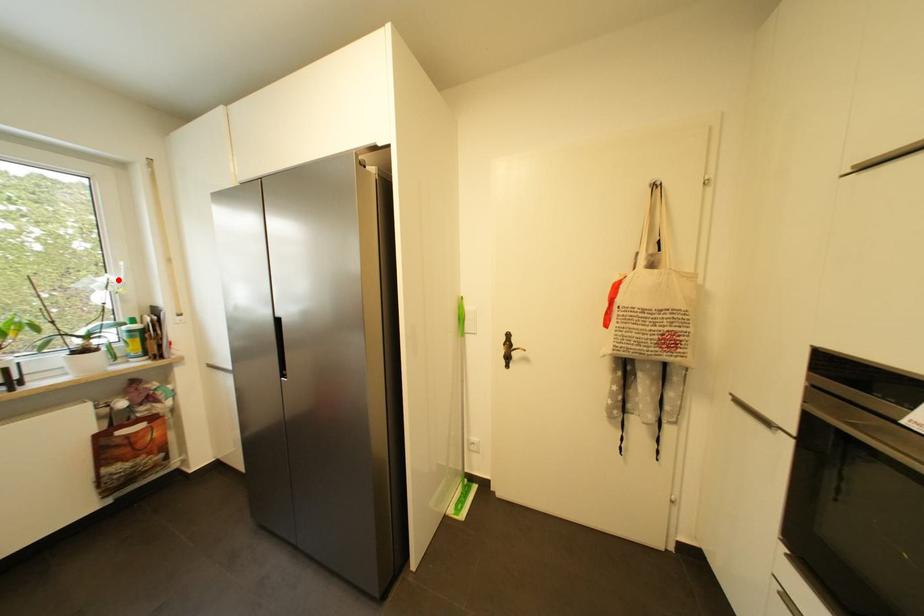
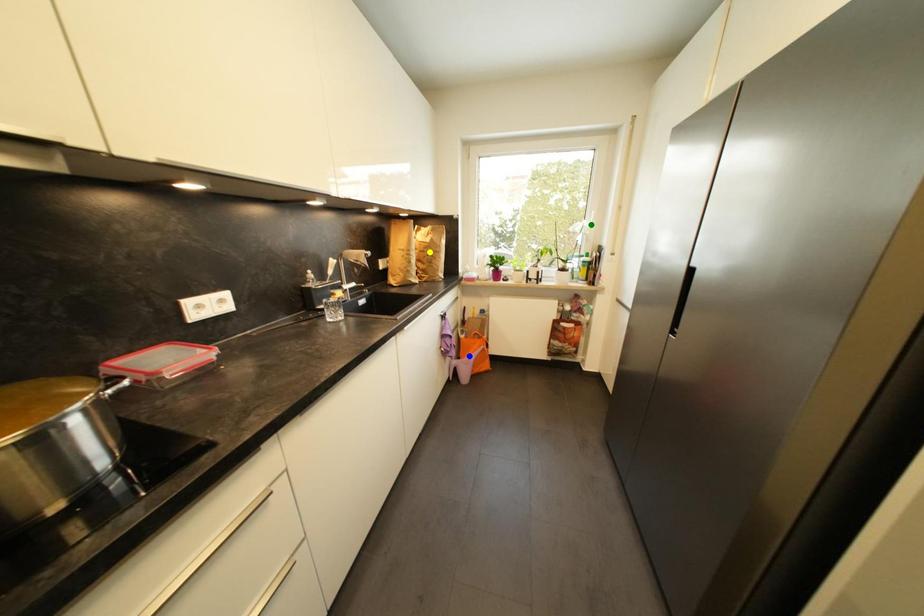
Question: I am providing you with two images of the same scene from different viewpoints. A red point is marked on the first image. You are given multiple points on the second image. Which point in image 2 represents the same 3d spot as the red point in image 1?

Choices:
 (A) blue point
 (B) green point
 (C) yellow point

Answer: (B)